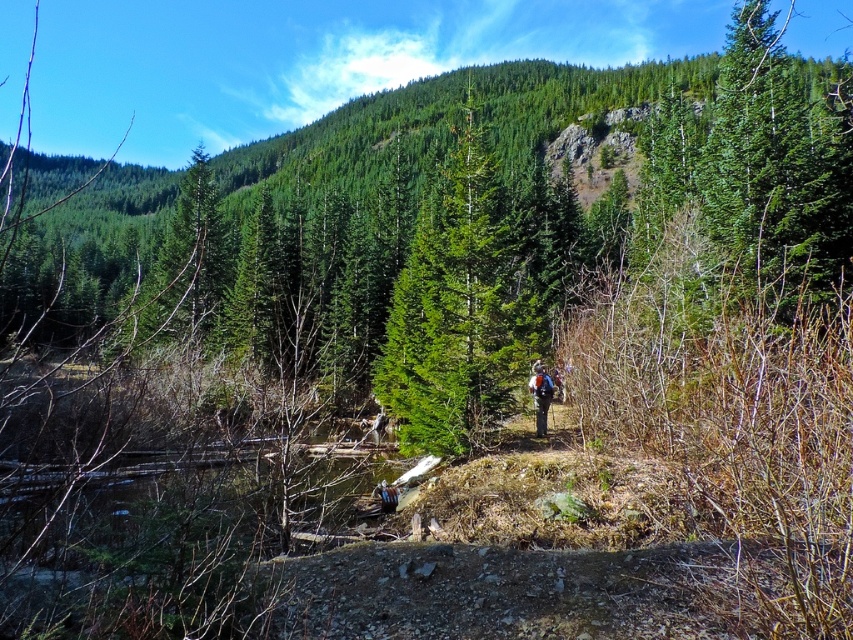
You are a hiker who wants to take a photo of the camouflage backpack at center without the green matte tree at center blocking the view. Which direction should you move to ensure the tree is out of frame?

The green matte tree at center is above the camouflage backpack at center, so if you move to the right or left, you can position yourself so the tree is no longer blocking the backpack.

You are a hiker planning to walk along the narrow dirt path in the foreground. You notice a green matte tree at center and a camouflage backpack at center. Which object is wider in terms of their physical dimensions?

The green matte tree at center is wider than the camouflage backpack at center, as its width surpasses that of the backpack.

You are standing at the point marked as point (456,310) in the image. What is the nearest object to you?

The nearest object to you is the green matte tree at center, as the point (456,310) is located on it.